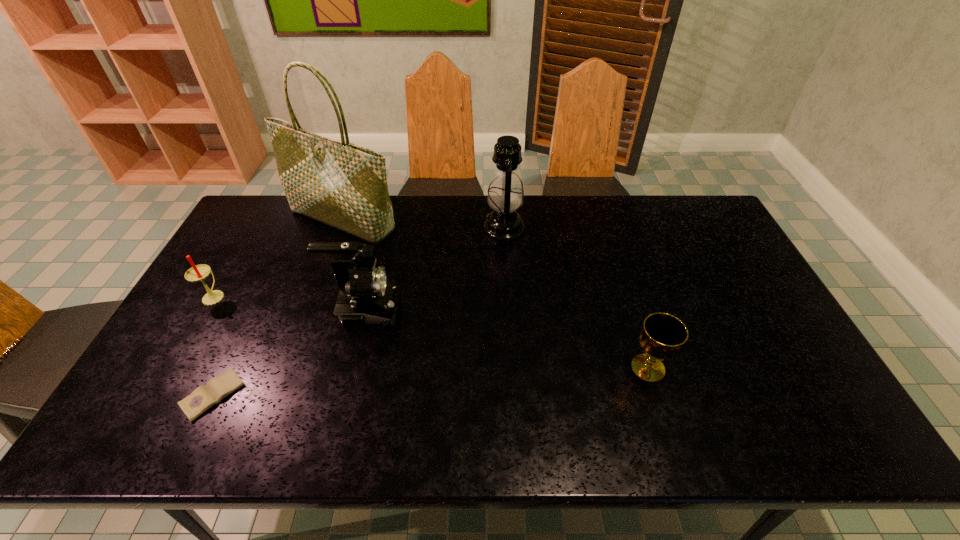
Where is `object located at the near left corner`? The width and height of the screenshot is (960, 540). object located at the near left corner is located at coordinates (204, 397).

Where is `free space at the far edge of the desktop`? This screenshot has width=960, height=540. free space at the far edge of the desktop is located at coordinates (425, 231).

Locate an element on the screen. The width and height of the screenshot is (960, 540). vacant area at the near edge is located at coordinates (728, 446).

This screenshot has width=960, height=540. Identify the location of free point at the right edge. (758, 300).

In the image, there is a desktop. Where is `free space at the far right corner`? free space at the far right corner is located at coordinates (672, 200).

Identify the location of free point between the shortest object and the leftmost object. (213, 345).

Where is `free space between the shopping bag and the chalice`? Image resolution: width=960 pixels, height=540 pixels. free space between the shopping bag and the chalice is located at coordinates (495, 294).

You are a GUI agent. You are given a task and a screenshot of the screen. Output one action in this format:
    pyautogui.click(x=<x>, y=<y>)
    Task: Click on the free space between the fifth shortest object and the camcorder
    Image resolution: width=960 pixels, height=540 pixels.
    Given the screenshot: What is the action you would take?
    pyautogui.click(x=435, y=269)

Where is `free point between the tallest object and the shortest object`? free point between the tallest object and the shortest object is located at coordinates tap(277, 308).

What are the coordinates of `free space that is in between the candle and the camcorder` in the screenshot? It's located at (290, 303).